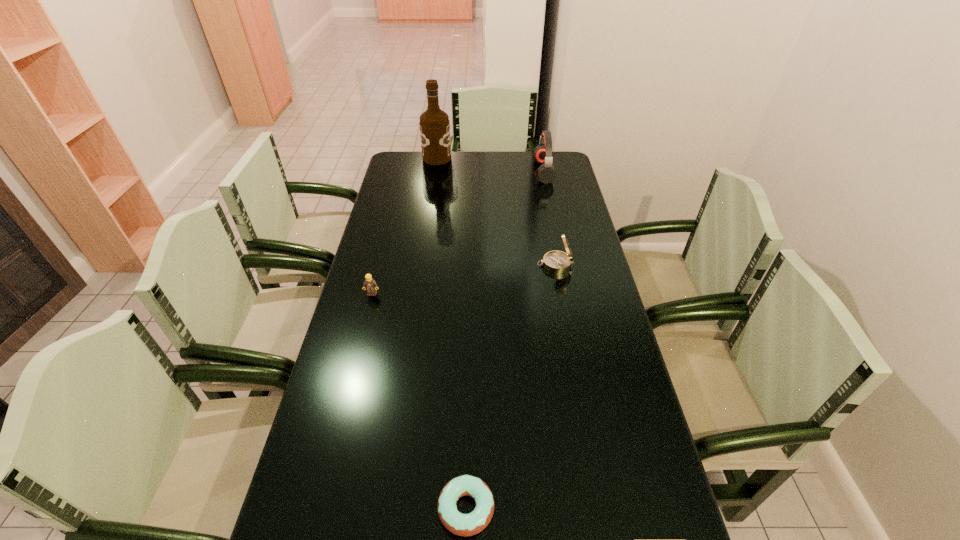
The height and width of the screenshot is (540, 960). What are the coordinates of `alcohol that is at the left edge` in the screenshot? It's located at (434, 123).

Identify the location of Lego at the left edge. The height and width of the screenshot is (540, 960). (369, 284).

Locate an element on the screen. This screenshot has height=540, width=960. earphone that is at the right edge is located at coordinates (543, 152).

Identify the location of compass at the right edge. The height and width of the screenshot is (540, 960). (558, 262).

Identify the location of object that is at the far left corner. (434, 123).

Where is `object situated at the far right corner`? Image resolution: width=960 pixels, height=540 pixels. object situated at the far right corner is located at coordinates (543, 152).

Identify the location of vacant space at the far edge. The width and height of the screenshot is (960, 540). (492, 153).

Locate an element on the screen. The height and width of the screenshot is (540, 960). vacant space at the left edge of the desktop is located at coordinates (354, 410).

Find the location of a particular element. free space at the right edge is located at coordinates (628, 379).

Find the location of a particular element. The height and width of the screenshot is (540, 960). free spot at the far left corner of the desktop is located at coordinates (402, 169).